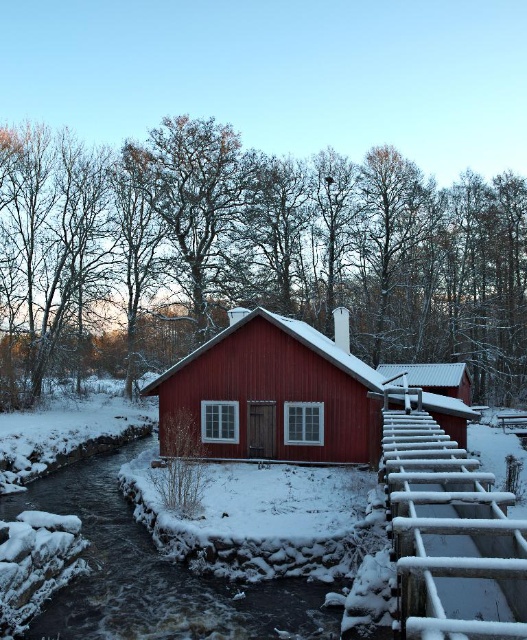
Who is more forward, (x=307, y=390) or (x=422, y=506)?

Point (x=422, y=506) is in front.

Which is below, matte wood cabin at center or white wooden rail at lower right?

white wooden rail at lower right is below.

Which is in front, point (337, 353) or point (398, 540)?

Point (398, 540)

Identify the location of matte wood cabin at center. (268, 396).